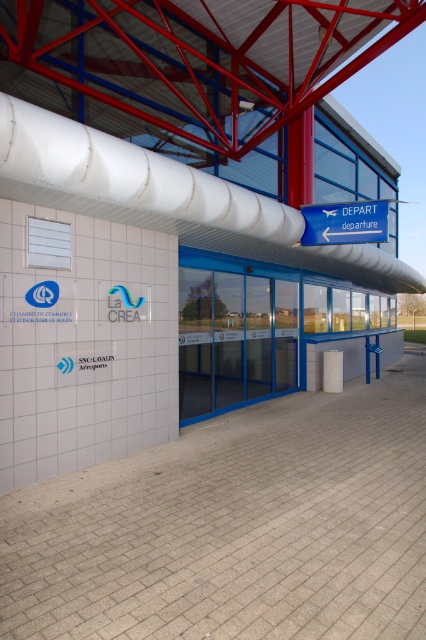
You are standing at the entrance of the building and need to locate the blue plastic sign at upper center. Is it positioned in front of or behind the white concrete pillar at center?

The blue plastic sign at upper center is closer to the viewer than the white concrete pillar at center, so it is positioned in front of the white concrete pillar at center.